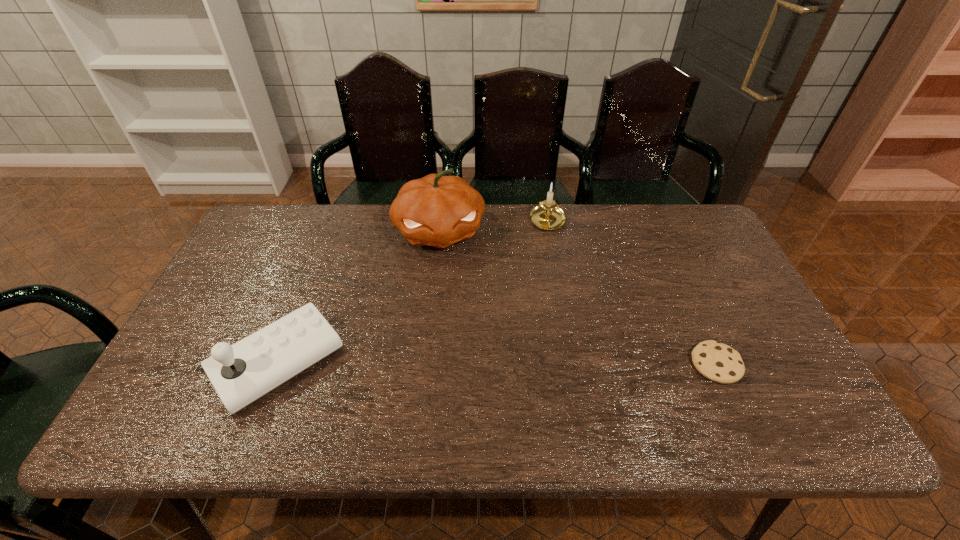
Where is `joystick`? joystick is located at coordinates (241, 373).

Where is `cookie`? The height and width of the screenshot is (540, 960). cookie is located at coordinates (718, 362).

Where is `the rightmost object`? the rightmost object is located at coordinates (718, 362).

Locate an element on the screen. The image size is (960, 540). the third object from right to left is located at coordinates (437, 210).

This screenshot has height=540, width=960. In order to click on pumpkin in this screenshot , I will do click(437, 210).

Image resolution: width=960 pixels, height=540 pixels. Identify the location of candle holder. (547, 215).

This screenshot has width=960, height=540. I want to click on free space located on the back of the leftmost object, so click(309, 284).

Identify the location of free point located 0.390m on the back of the rightmost object. (662, 244).

Locate an element on the screen. The image size is (960, 540). vacant area situated on the front face of the third object from right to left is located at coordinates (450, 282).

Locate an element on the screen. vacant space located on the front face of the third object from right to left is located at coordinates click(x=465, y=355).